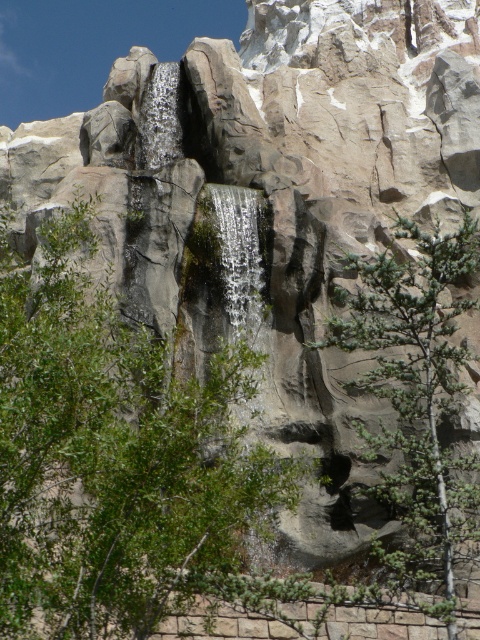
Question: Among these points, which one is farthest from the camera?

Choices:
 (A) (24, 504)
 (B) (453, 632)

Answer: (B)

Question: Does green leafy tree at center have a larger size compared to green textured tree at center?

Choices:
 (A) no
 (B) yes

Answer: (B)

Question: Does green leafy tree at center appear over green textured tree at center?

Choices:
 (A) no
 (B) yes

Answer: (A)

Question: Among these objects, which one is nearest to the camera?

Choices:
 (A) green leafy tree at center
 (B) green textured tree at center

Answer: (A)

Question: Does green leafy tree at center appear on the left side of green textured tree at center?

Choices:
 (A) yes
 (B) no

Answer: (A)